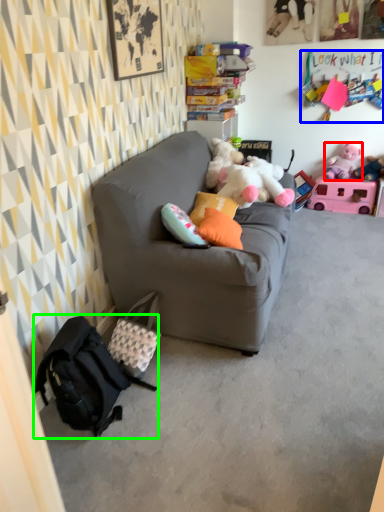
Question: Which is farther away from toy (highlighted by a red box)? toy (highlighted by a blue box) or backpack (highlighted by a green box)?

Choices:
 (A) toy
 (B) backpack

Answer: (B)